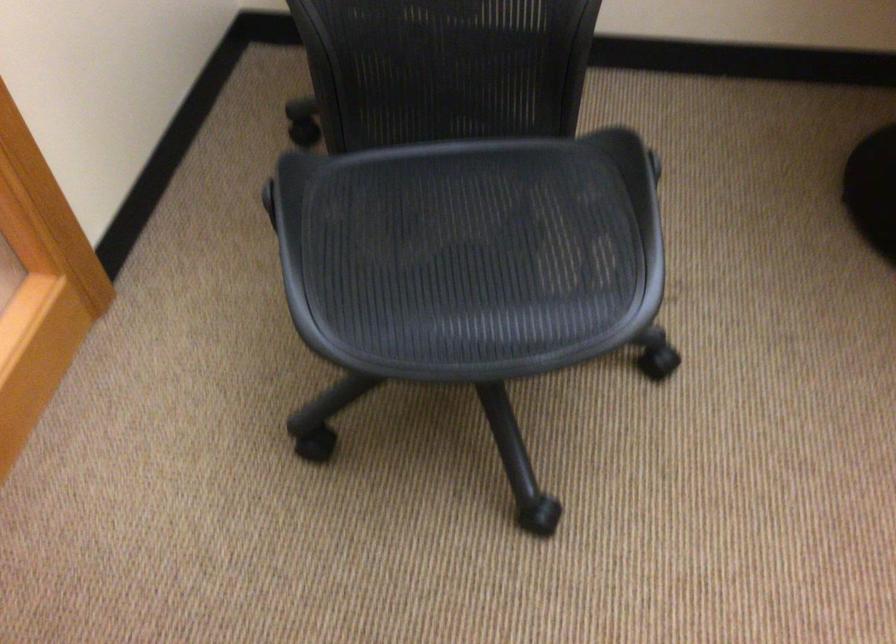
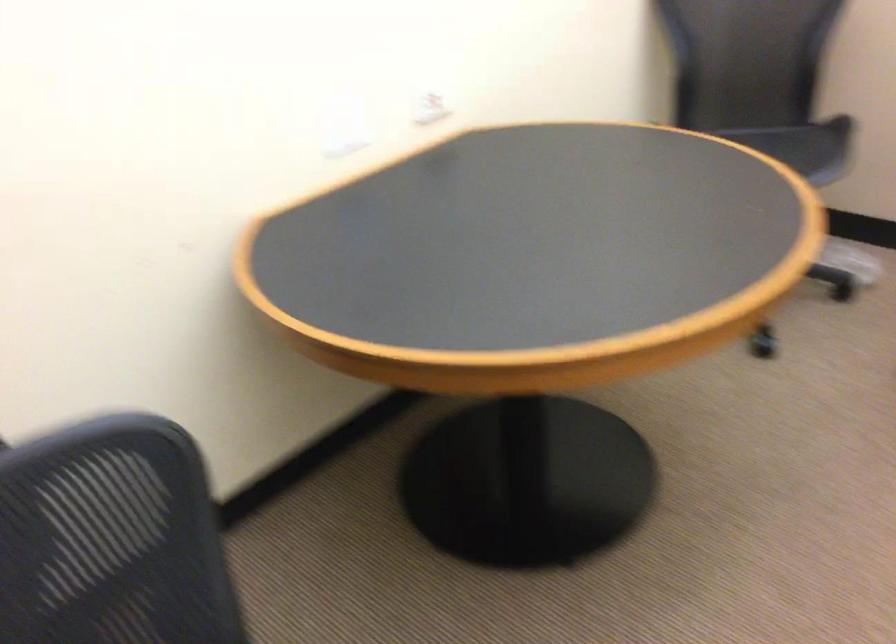
Question: How did the camera likely rotate?

Choices:
 (A) Left
 (B) Right
 (C) Up
 (D) Down

Answer: (B)